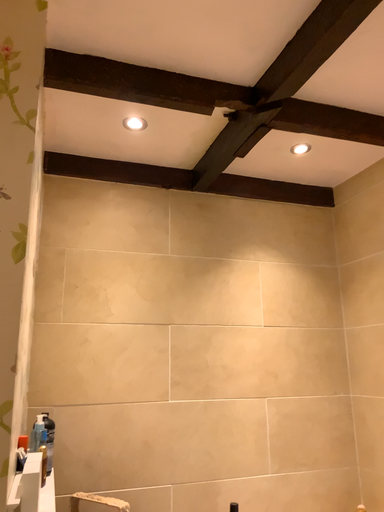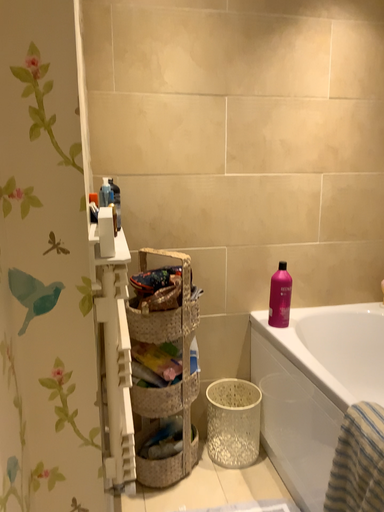
Question: Which way did the camera rotate in the video?

Choices:
 (A) rotated upward
 (B) rotated downward

Answer: (B)